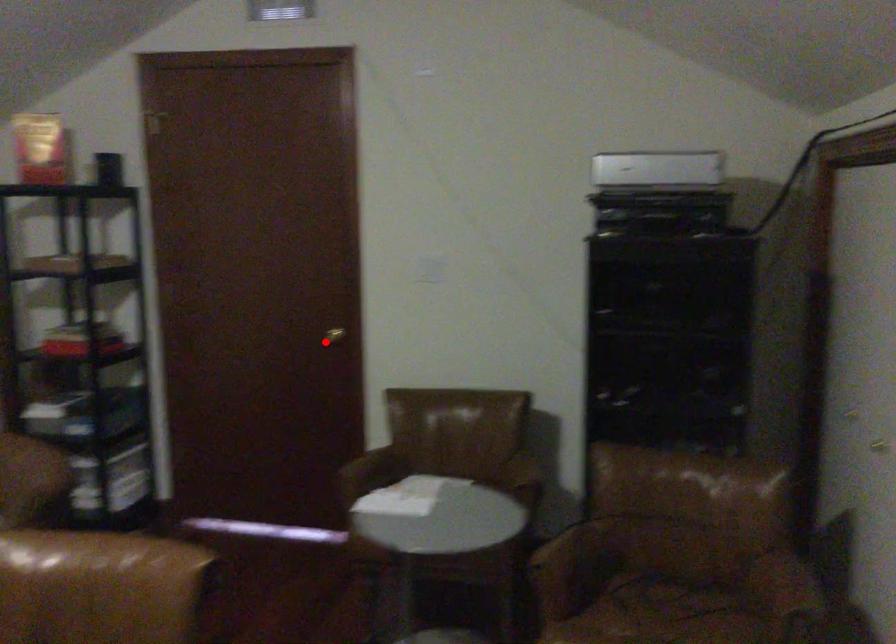
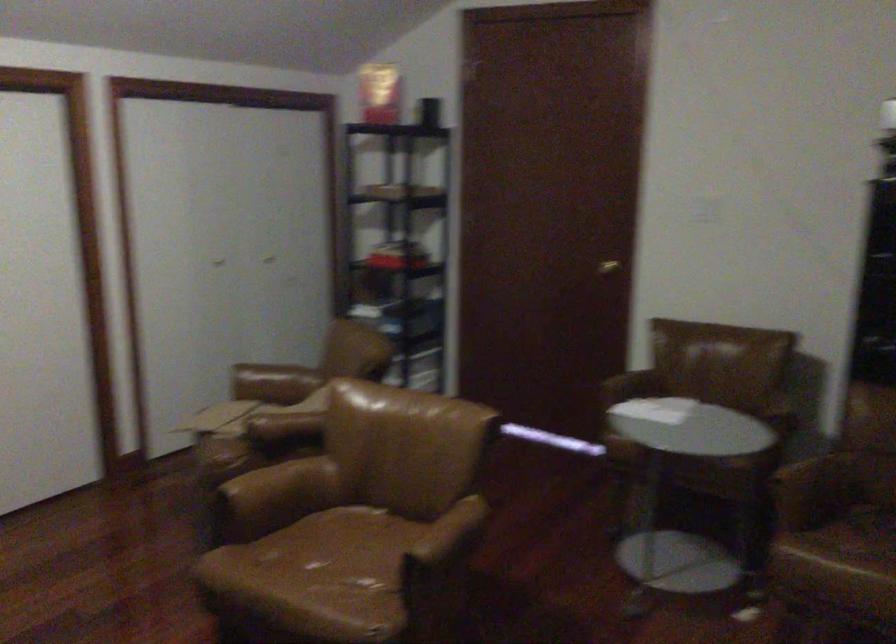
Find the pixel in the second image that matches the highlighted location in the first image.

(607, 267)